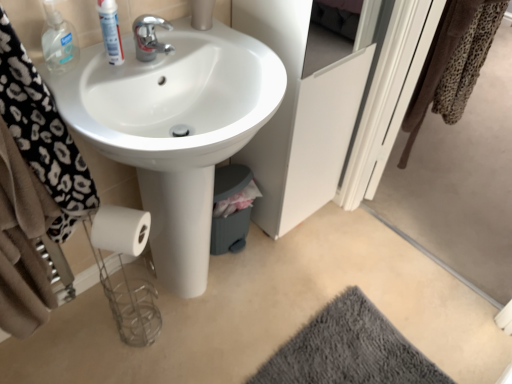
Question: Are clear plastic bottle at upper left, the 2th mouthwash viewed from the right, and transparent plastic screen door at upper right, which is the 2th screen door in left-to-right order, located far from each other?

Choices:
 (A) yes
 (B) no

Answer: (A)

Question: Is clear plastic bottle at upper left, the 2th mouthwash viewed from the right, positioned in front of transparent plastic screen door at upper right, which is the 2th screen door in left-to-right order?

Choices:
 (A) no
 (B) yes

Answer: (A)

Question: Is clear plastic bottle at upper left, the 2th mouthwash viewed from the right, at the right side of transparent plastic screen door at upper right, which is the 2th screen door in left-to-right order?

Choices:
 (A) no
 (B) yes

Answer: (A)

Question: Is transparent plastic screen door at upper right, which is the 2th screen door in left-to-right order, completely or partially inside clear plastic bottle at upper left, the 2th mouthwash viewed from the right?

Choices:
 (A) no
 (B) yes

Answer: (A)

Question: Considering the relative positions of clear plastic bottle at upper left, the 2th mouthwash viewed from the right, and transparent plastic screen door at upper right, which is the 2th screen door in left-to-right order, in the image provided, is clear plastic bottle at upper left, the 2th mouthwash viewed from the right, behind transparent plastic screen door at upper right, which is the 2th screen door in left-to-right order,?

Choices:
 (A) no
 (B) yes

Answer: (B)

Question: Is clear plastic bottle at upper left, the 2th mouthwash viewed from the right, positioned beyond the bounds of transparent plastic screen door at upper right, arranged as the first screen door when viewed from the right?

Choices:
 (A) yes
 (B) no

Answer: (A)

Question: Is the position of chrome metallic faucet at upper center more distant than that of transparent plastic screen door at upper right, arranged as the first screen door when viewed from the right?

Choices:
 (A) yes
 (B) no

Answer: (A)

Question: Is chrome metallic faucet at upper center next to transparent plastic screen door at upper right, which is the 2th screen door in left-to-right order?

Choices:
 (A) yes
 (B) no

Answer: (B)

Question: Can you confirm if chrome metallic faucet at upper center is positioned to the left of transparent plastic screen door at upper right, which is the 2th screen door in left-to-right order?

Choices:
 (A) yes
 (B) no

Answer: (A)

Question: Is chrome metallic faucet at upper center oriented towards transparent plastic screen door at upper right, arranged as the first screen door when viewed from the right?

Choices:
 (A) yes
 (B) no

Answer: (B)

Question: Can you confirm if chrome metallic faucet at upper center is taller than transparent plastic screen door at upper right, which is the 2th screen door in left-to-right order?

Choices:
 (A) no
 (B) yes

Answer: (A)

Question: From the image's perspective, does chrome metallic faucet at upper center appear lower than transparent plastic screen door at upper right, which is the 2th screen door in left-to-right order?

Choices:
 (A) yes
 (B) no

Answer: (B)

Question: Is leopard print towel at upper right turned away from white glossy sink at center?

Choices:
 (A) no
 (B) yes

Answer: (A)